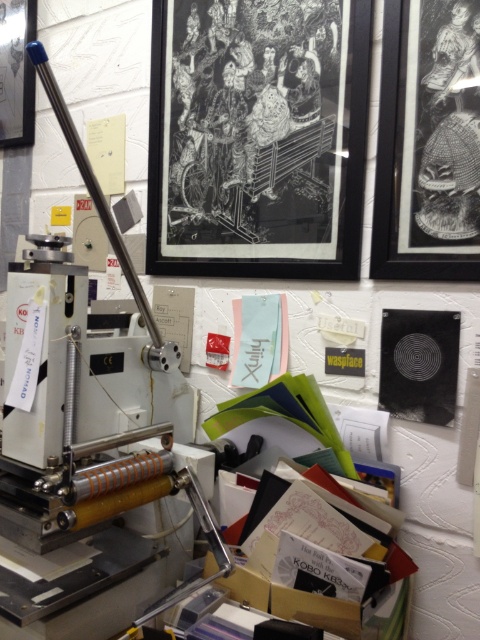
Is point (191, 42) behind point (460, 266)?

Yes.

Does black matte picture frame at upper center appear under black matte picture frame at upper right?

No, black matte picture frame at upper center is not below black matte picture frame at upper right.

Is point (263, 160) closer to camera compared to point (384, 252)?

No, (263, 160) is behind (384, 252).

Locate an element on the screen. The width and height of the screenshot is (480, 640). black matte picture frame at upper center is located at coordinates (257, 138).

Consider the image. Who is lower down, black matte picture frame at upper center or matte black picture frame at upper left?

black matte picture frame at upper center

Is the position of black matte picture frame at upper center less distant than that of matte black picture frame at upper left?

Yes, it is.

Looking at this image, who is more distant from viewer, (265, 252) or (7, 38)?

Point (7, 38)

Locate an element on the screen. black matte picture frame at upper center is located at coordinates (257, 138).

Which is more to the right, black matte picture frame at upper right or matte black picture frame at upper left?

black matte picture frame at upper right

This screenshot has width=480, height=640. What are the coordinates of `black matte picture frame at upper right` in the screenshot? It's located at (427, 147).

Find the location of a particular element. Image resolution: width=480 pixels, height=640 pixels. black matte picture frame at upper right is located at coordinates (427, 147).